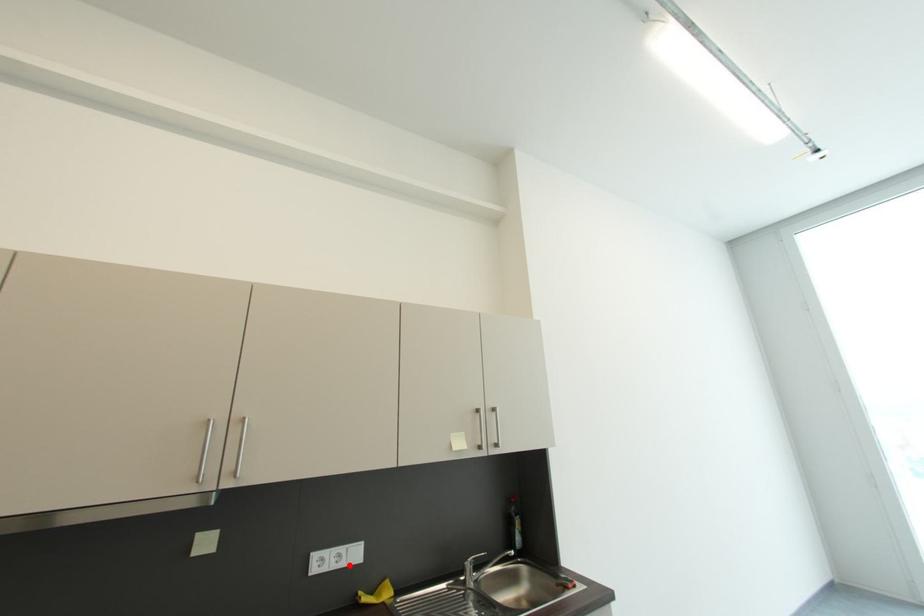
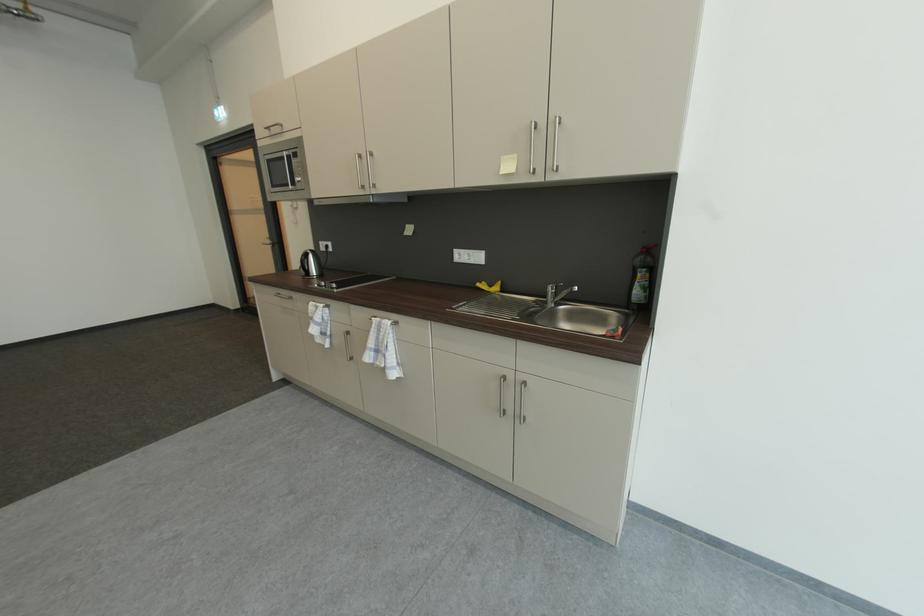
The point at the highlighted location is marked in the first image. Where is the corresponding point in the second image?

(479, 262)